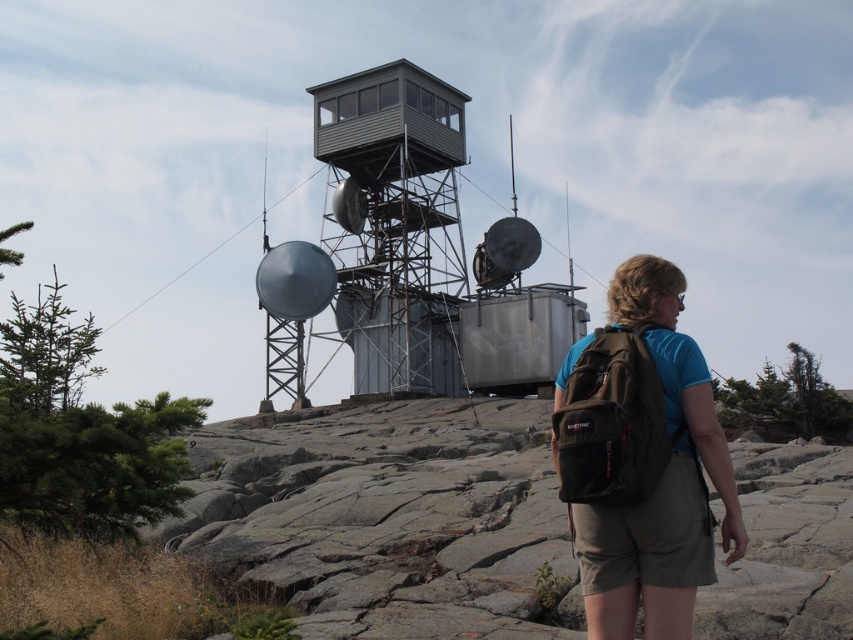
Question: Can you confirm if brown fabric backpack at right is thinner than gray metallic observation tower at center?

Choices:
 (A) no
 (B) yes

Answer: (B)

Question: Can you confirm if brown fabric backpack at right is positioned to the right of gray metallic observation tower at center?

Choices:
 (A) yes
 (B) no

Answer: (A)

Question: Can you confirm if brown fabric backpack at right is smaller than metallic gray observation tower at center?

Choices:
 (A) no
 (B) yes

Answer: (B)

Question: Which point is farther from the camera taking this photo?

Choices:
 (A) (653, 417)
 (B) (451, 218)
 (C) (339, 131)

Answer: (B)

Question: Estimate the real-world distances between objects in this image. Which object is farther from the gray metallic observation tower at center?

Choices:
 (A) metallic gray observation tower at center
 (B) brown fabric backpack at right

Answer: (B)

Question: Which point is farther to the camera?

Choices:
 (A) (669, 262)
 (B) (283, 349)

Answer: (B)